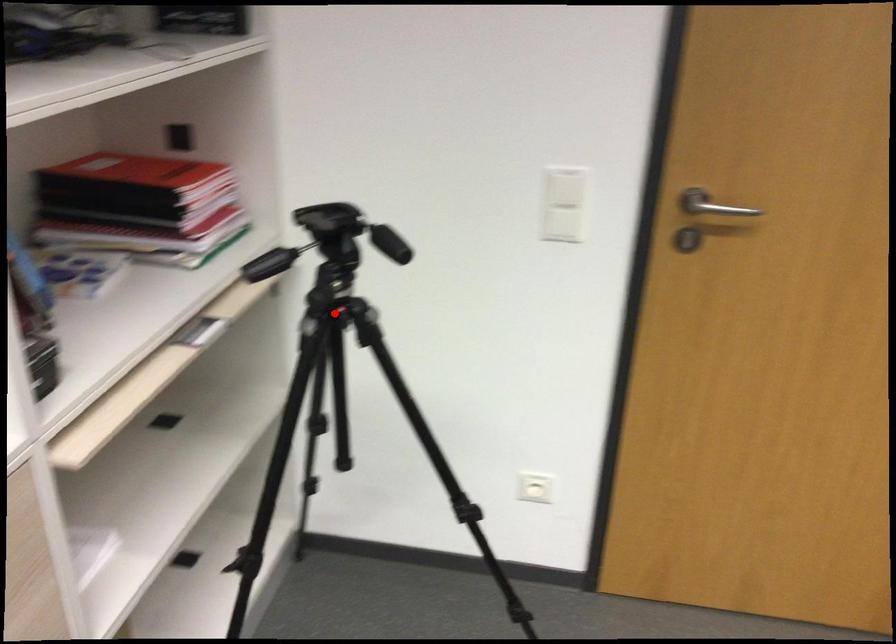
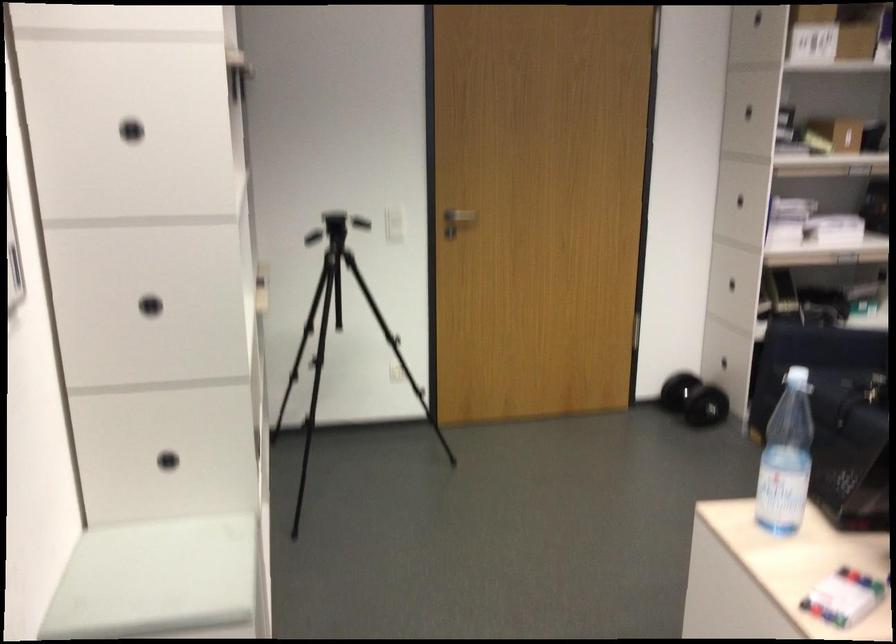
Question: I am providing you with two images of the same scene from different viewpoints. A red point is marked on the first image. At the location where the point appears in image 1, is it still visible in image 2?

Choices:
 (A) Yes
 (B) No

Answer: (B)